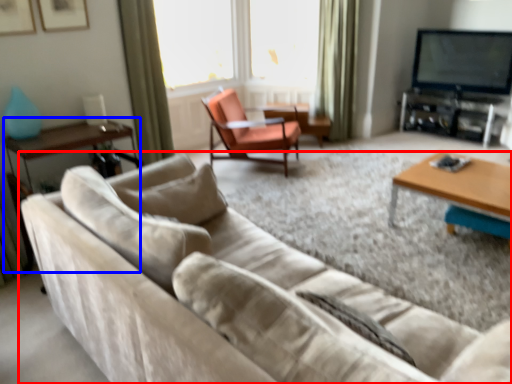
Question: Among these objects, which one is farthest to the camera, studio couch (highlighted by a red box) or side table (highlighted by a blue box)?

Choices:
 (A) studio couch
 (B) side table

Answer: (B)